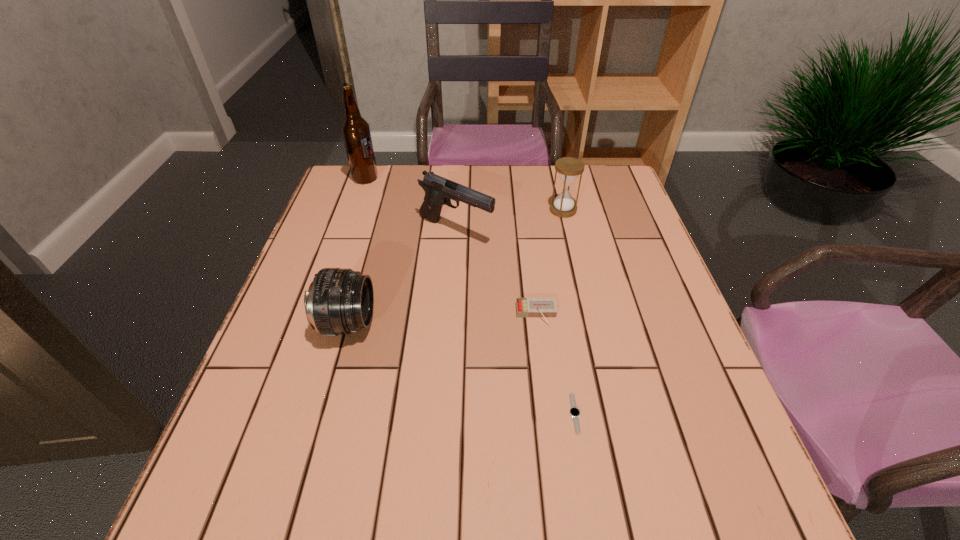
The height and width of the screenshot is (540, 960). I want to click on free area in between the second shortest object and the hourglass, so click(550, 262).

At what (x,y) coordinates should I click in order to perform the action: click on unoccupied area between the matchbox and the watch. Please return your answer as a coordinate pair (x, y). Looking at the image, I should click on (556, 364).

Locate an element on the screen. free space between the telephoto lens and the tallest object is located at coordinates (357, 251).

Where is `unoccupied position between the watch and the hourglass`? This screenshot has width=960, height=540. unoccupied position between the watch and the hourglass is located at coordinates (569, 312).

Where is `the third closest object to the telephoto lens`? the third closest object to the telephoto lens is located at coordinates (574, 412).

Point out which object is positioned as the fifth nearest to the farthest object. Please provide its 2D coordinates. Your answer should be formatted as a tuple, i.e. [(x, y)], where the tuple contains the x and y coordinates of a point satisfying the conditions above.

[(574, 412)]

Identify the location of vacant area in the image that satisfies the following two spatial constraints: 1. at the muzzle of the watch; 2. on the right side of the third object from left to right. This screenshot has height=540, width=960. (444, 413).

What are the coordinates of `vacant point that satisfies the following two spatial constraints: 1. on the back side of the shortest object; 2. at the front element of the telephoto lens` in the screenshot? It's located at (560, 323).

Locate an element on the screen. This screenshot has height=540, width=960. vacant position in the image that satisfies the following two spatial constraints: 1. on the striking surface of the fifth tallest object; 2. at the front element of the telephoto lens is located at coordinates (538, 323).

The height and width of the screenshot is (540, 960). Find the location of `free space in the image that satisfies the following two spatial constraints: 1. on the back side of the rightmost object; 2. on the label of the tallest object`. free space in the image that satisfies the following two spatial constraints: 1. on the back side of the rightmost object; 2. on the label of the tallest object is located at coordinates (556, 179).